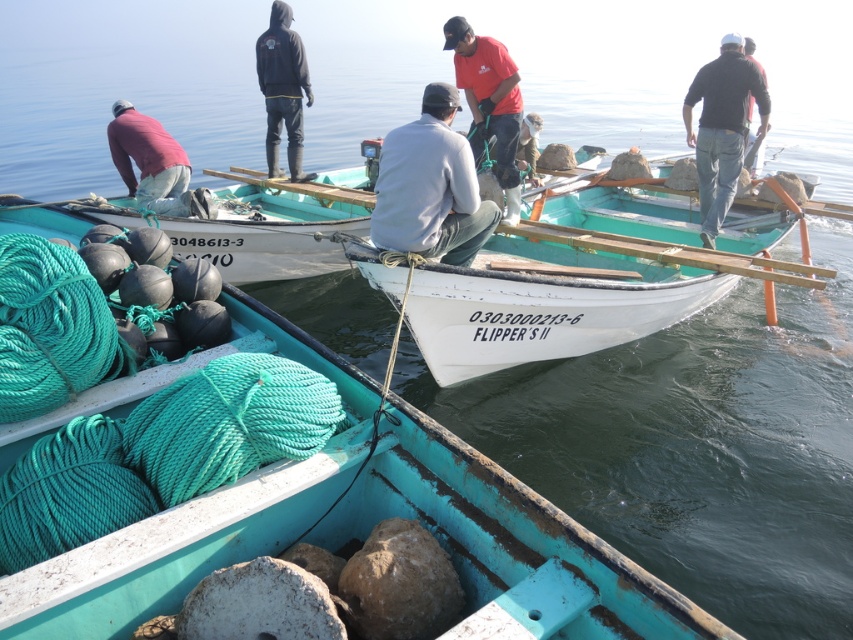
Question: Can you confirm if teal painted wood boat at center is positioned below gray matte shirt at center?

Choices:
 (A) no
 (B) yes

Answer: (B)

Question: Can you confirm if red cotton shirt at center is wider than matte pink shirt at lower left?

Choices:
 (A) no
 (B) yes

Answer: (A)

Question: Which of the following is the closest to the observer?

Choices:
 (A) red cotton shirt at center
 (B) white matte boat at center

Answer: (B)

Question: Which point appears farthest from the camera in this image?

Choices:
 (A) (514, 182)
 (B) (119, 128)
 (C) (695, 76)

Answer: (C)

Question: Which of these objects is positioned closest to the dark gray sweater at upper center?

Choices:
 (A) teal painted wood boat at center
 (B) white matte boat at center
 (C) matte pink shirt at lower left

Answer: (B)

Question: Is red cotton shirt at center below matte pink shirt at lower left?

Choices:
 (A) yes
 (B) no

Answer: (B)